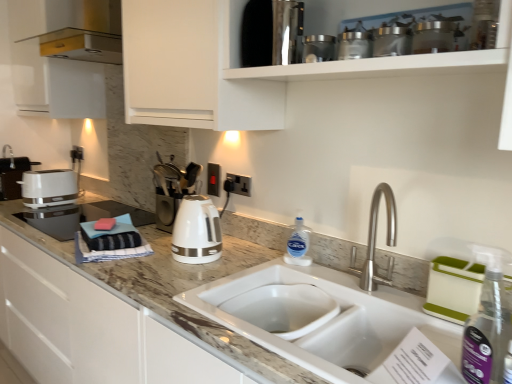
Identify the location of vacant area that is situated to the right of white glossy toaster at left. (84, 205).